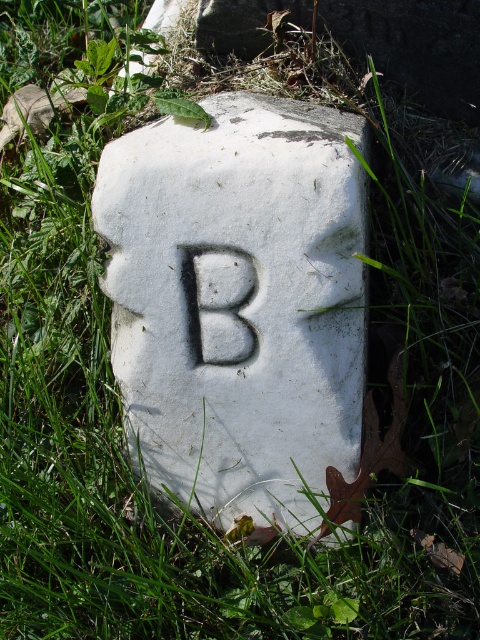
Question: Among these points, which one is farthest from the camera?

Choices:
 (A) (240, 259)
 (B) (135, 422)

Answer: (B)

Question: Is the position of white stone at center less distant than that of white stone letter b at center?

Choices:
 (A) no
 (B) yes

Answer: (B)

Question: Which point appears closest to the camera in this image?

Choices:
 (A) (364, 193)
 (B) (188, 273)

Answer: (B)

Question: Does white stone at center appear under white stone letter b at center?

Choices:
 (A) yes
 (B) no

Answer: (A)

Question: Which object is farther from the camera taking this photo?

Choices:
 (A) white stone letter b at center
 (B) white stone at center

Answer: (A)

Question: Can you confirm if white stone at center is positioned to the left of white stone letter b at center?

Choices:
 (A) no
 (B) yes

Answer: (A)